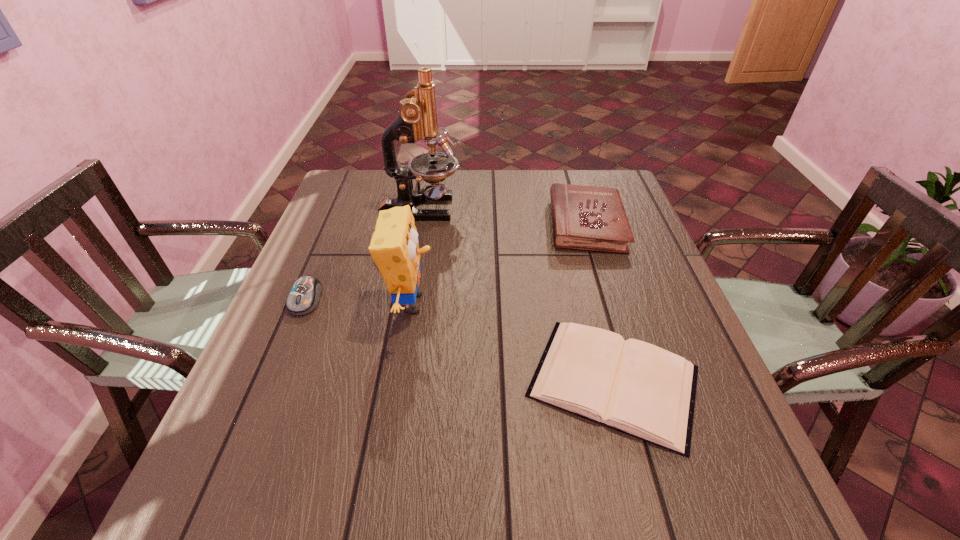
Find the location of `the tallest object`. the tallest object is located at coordinates [417, 118].

Where is `sponge`? The height and width of the screenshot is (540, 960). sponge is located at coordinates (394, 247).

Find the location of a particular element. The image size is (960, 540). the farther hardback book is located at coordinates (592, 218).

The image size is (960, 540). What are the coordinates of `the third shortest object` in the screenshot? It's located at (592, 218).

Image resolution: width=960 pixels, height=540 pixels. In order to click on computer mouse in this screenshot , I will do `click(303, 298)`.

Identify the location of the leftmost object. This screenshot has height=540, width=960. (303, 298).

The image size is (960, 540). Identify the location of the shortest object. (x=637, y=388).

Where is `the nearer hardback book`? The width and height of the screenshot is (960, 540). the nearer hardback book is located at coordinates (637, 388).

Identify the location of vacant point located 0.190m at the eyepiece of the microscope. The image size is (960, 540). (524, 208).

At what (x,y) coordinates should I click in order to perform the action: click on free point located on the face of the second tallest object. Please return your answer as a coordinate pair (x, y). Looking at the image, I should click on (607, 303).